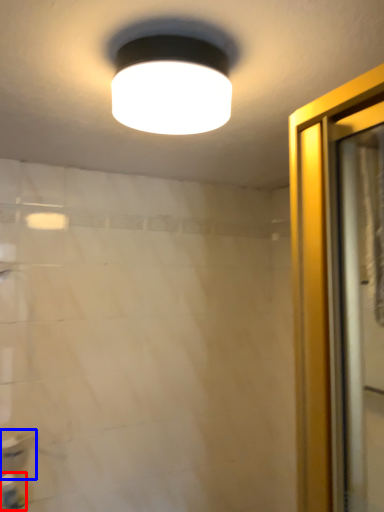
Question: Which point is closer to the camera, toiletry (highlighted by a red box) or sink (highlighted by a blue box)?

Choices:
 (A) toiletry
 (B) sink

Answer: (A)